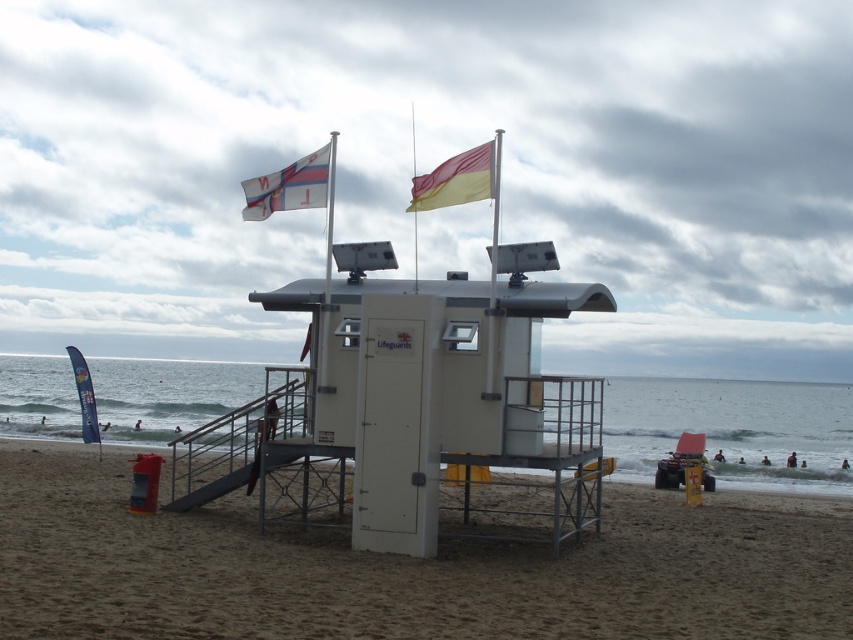
You are standing at the beach and want to know which object is wider between the sandy brown at center and the yellow matte flag at upper center. Could you tell me which one is wider?

The sandy brown at center is wider than the yellow matte flag at upper center according to the description.

You are standing at the sandy brown at center and want to reach the lifeguard station which is 6.77 meters away. If you walk straight towards it, will you have to climb any steps?

The sandy brown at center and viewer are 6.77 meters apart, so you will not have to climb any steps as the path is flat.